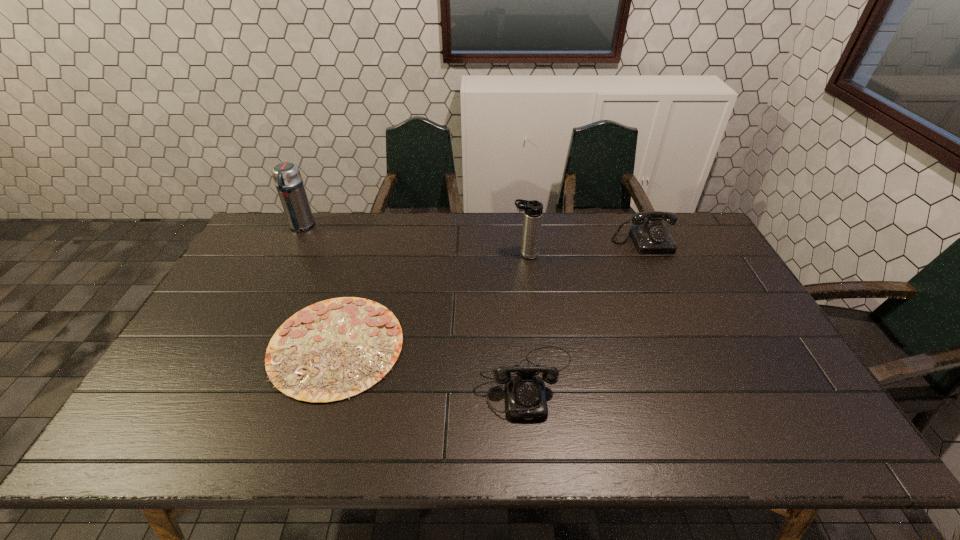
Where is `the farther thermos bottle`? the farther thermos bottle is located at coordinates (286, 175).

Where is `the leftmost object`? The width and height of the screenshot is (960, 540). the leftmost object is located at coordinates (286, 175).

The width and height of the screenshot is (960, 540). Identify the location of the nearer thermos bottle. (533, 210).

Locate an element on the screen. The height and width of the screenshot is (540, 960). the right telephone is located at coordinates (650, 236).

Identify the location of the farther telephone. (650, 236).

This screenshot has height=540, width=960. In order to click on the nearer telephone in this screenshot , I will do `click(526, 396)`.

Locate an element on the screen. the shortest object is located at coordinates (334, 349).

Locate an element on the screen. This screenshot has height=540, width=960. pizza is located at coordinates (334, 349).

At what (x,y) coordinates should I click in order to perform the action: click on blank area located 0.130m with a handle on the side of the left thermos bottle. Please return your answer as a coordinate pair (x, y). This screenshot has height=540, width=960. Looking at the image, I should click on (284, 259).

At what (x,y) coordinates should I click in order to perform the action: click on free location located 0.370m on the handle side of the right thermos bottle. Please return your answer as a coordinate pair (x, y). The height and width of the screenshot is (540, 960). Looking at the image, I should click on (401, 254).